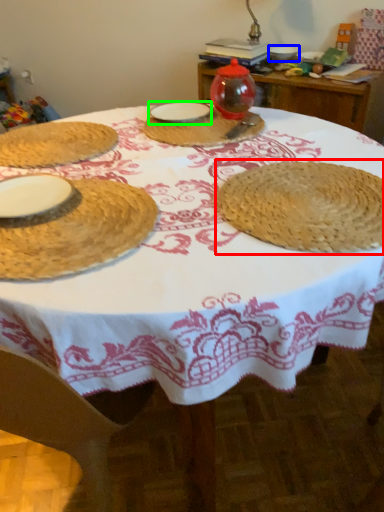
Question: Which is nearer to the straw hat (highlighted by a red box)? tableware (highlighted by a blue box) or tableware (highlighted by a green box).

Choices:
 (A) tableware
 (B) tableware

Answer: (B)